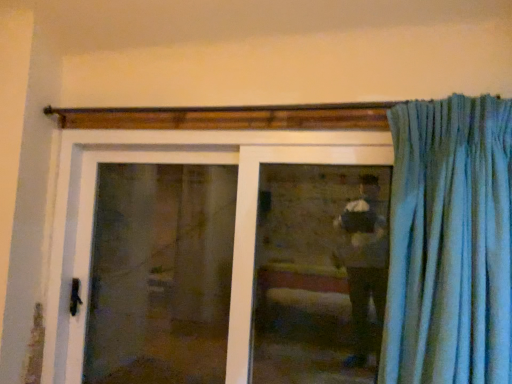
Question: Does white plastic door at center contain transparent glass screen door at center?

Choices:
 (A) yes
 (B) no

Answer: (B)

Question: Is white plastic door at center looking in the opposite direction of transparent glass screen door at center?

Choices:
 (A) yes
 (B) no

Answer: (A)

Question: Considering the relative sizes of white plastic door at center and transparent glass screen door at center in the image provided, is white plastic door at center smaller than transparent glass screen door at center?

Choices:
 (A) no
 (B) yes

Answer: (A)

Question: Is white plastic door at center thinner than transparent glass screen door at center?

Choices:
 (A) yes
 (B) no

Answer: (B)

Question: Is white plastic door at center next to transparent glass screen door at center?

Choices:
 (A) yes
 (B) no

Answer: (B)

Question: From the image's perspective, relative to transparent glass screen door at center, is white plastic door at center above or below?

Choices:
 (A) above
 (B) below

Answer: (B)

Question: Considering the positions of white plastic door at center and transparent glass screen door at center in the image, is white plastic door at center wider or thinner than transparent glass screen door at center?

Choices:
 (A) wide
 (B) thin

Answer: (A)

Question: Based on their sizes in the image, would you say white plastic door at center is bigger or smaller than transparent glass screen door at center?

Choices:
 (A) small
 (B) big

Answer: (B)

Question: In the image, is white plastic door at center positioned in front of or behind transparent glass screen door at center?

Choices:
 (A) front
 (B) behind

Answer: (A)

Question: Looking at the image, does transparent glass screen door at center seem bigger or smaller compared to clear glass window at center?

Choices:
 (A) big
 (B) small

Answer: (A)

Question: Looking at their shapes, would you say transparent glass screen door at center is wider or thinner than clear glass window at center?

Choices:
 (A) wide
 (B) thin

Answer: (A)

Question: In terms of height, does transparent glass screen door at center look taller or shorter compared to clear glass window at center?

Choices:
 (A) tall
 (B) short

Answer: (A)

Question: Is transparent glass screen door at center to the left or to the right of clear glass window at center in the image?

Choices:
 (A) left
 (B) right

Answer: (A)

Question: Is transparent glass screen door at center wider or thinner than white plastic door at center?

Choices:
 (A) wide
 (B) thin

Answer: (B)

Question: Is transparent glass screen door at center taller or shorter than white plastic door at center?

Choices:
 (A) tall
 (B) short

Answer: (A)